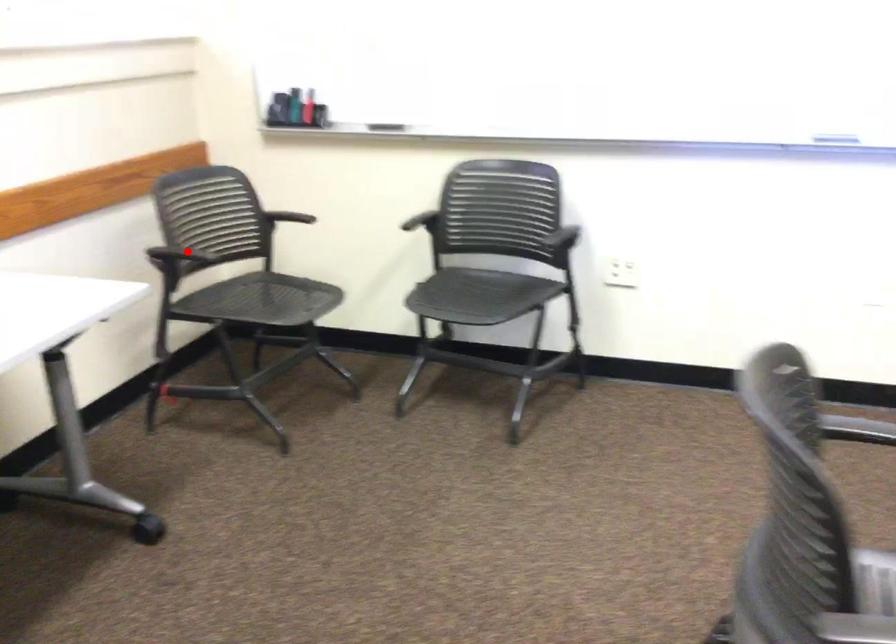
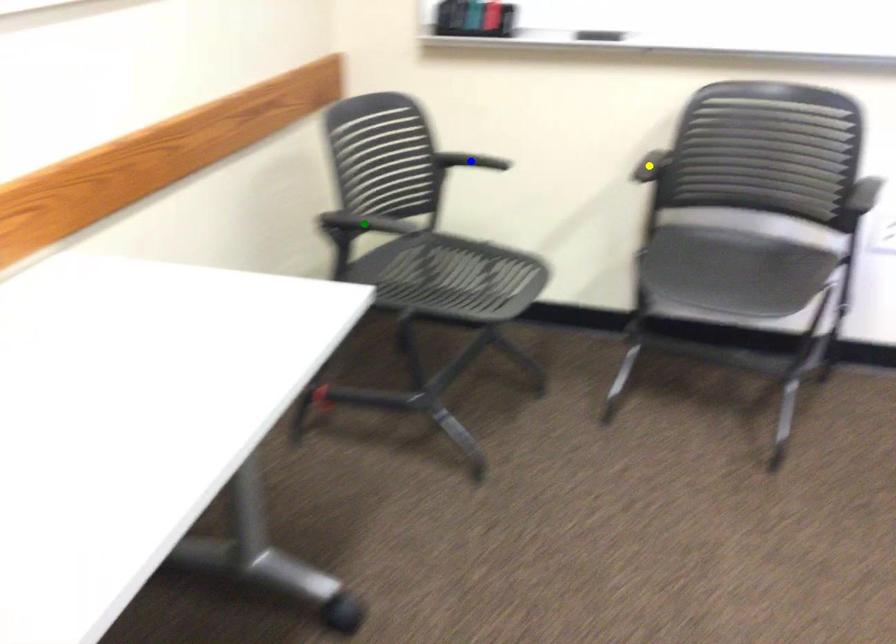
Question: I am providing you with two images of the same scene from different viewpoints. A red point is marked on the first image. You are given multiple points on the second image. Which point in image 2 represents the same 3d spot as the red point in image 1?

Choices:
 (A) yellow point
 (B) green point
 (C) blue point

Answer: (B)